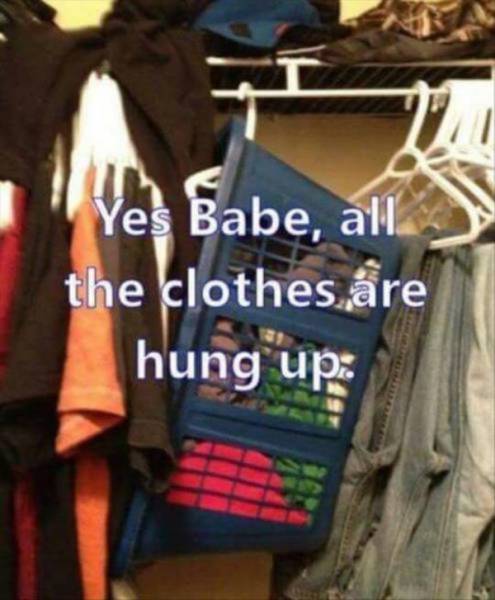
You are a GUI agent. You are given a task and a screenshot of the screen. Output one action in this format:
    pyautogui.click(x=<x>, y=<y>)
    Task: Click on the hangers on left
    
    Given the screenshot: What is the action you would take?
    pyautogui.click(x=66, y=127), pyautogui.click(x=261, y=309)